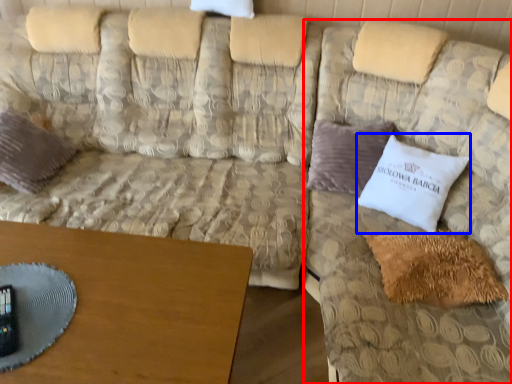
Question: Among these objects, which one is farthest to the camera, couch (highlighted by a red box) or pillow (highlighted by a blue box)?

Choices:
 (A) couch
 (B) pillow

Answer: (B)